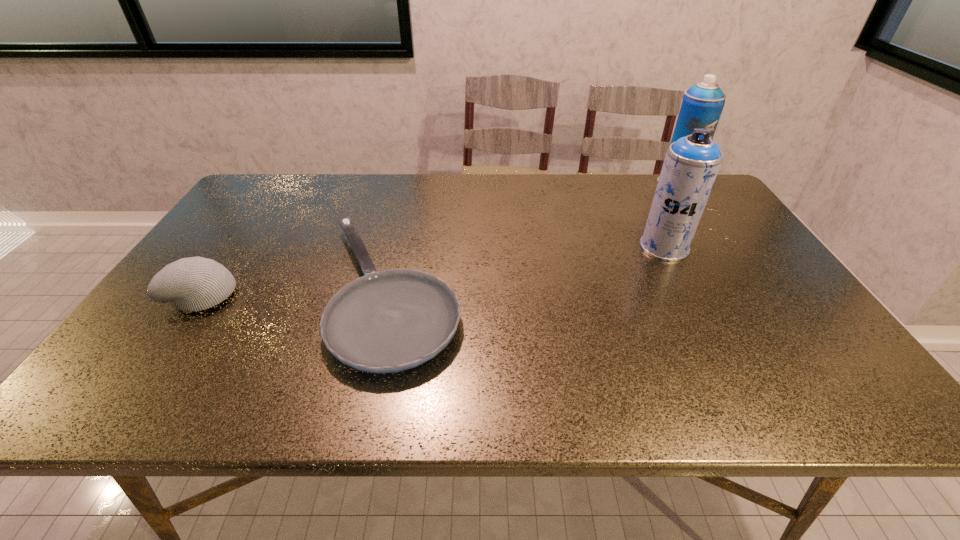
The width and height of the screenshot is (960, 540). Identify the location of vacant space located on the front of the leftmost object. (129, 402).

What are the coordinates of `vacant space located 0.170m on the right of the frying pan` in the screenshot? It's located at (530, 292).

I want to click on object that is positioned at the far edge, so pyautogui.click(x=702, y=105).

Find the location of a particular element. The image size is (960, 540). object located at the near edge is located at coordinates (388, 321).

This screenshot has width=960, height=540. What are the coordinates of `object that is positioned at the left edge` in the screenshot? It's located at (191, 284).

You are a GUI agent. You are given a task and a screenshot of the screen. Output one action in this format:
    pyautogui.click(x=<x>, y=<y>)
    Task: Click on the object located at the right edge
    Image resolution: width=960 pixels, height=540 pixels.
    Given the screenshot: What is the action you would take?
    pyautogui.click(x=702, y=105)

This screenshot has height=540, width=960. Find the location of `object that is positioned at the far right corner`. object that is positioned at the far right corner is located at coordinates 702,105.

At what (x,y) coordinates should I click in order to perform the action: click on free location at the far edge of the desktop. Please return your answer as a coordinate pair (x, y). The image size is (960, 540). Looking at the image, I should click on (494, 196).

This screenshot has width=960, height=540. Identify the location of vacant space at the right edge. coord(840,370).

I want to click on free region at the near left corner of the desktop, so click(x=101, y=380).